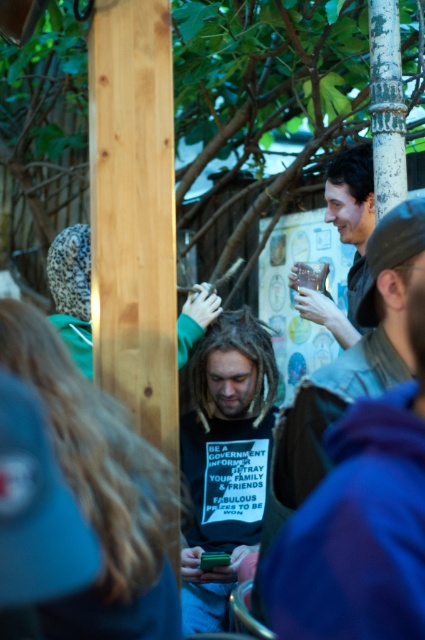
Can you confirm if dark brown leather jacket at center is positioned to the left of smooth brown leather jacket at upper right?

Correct, you'll find dark brown leather jacket at center to the left of smooth brown leather jacket at upper right.

Can you confirm if dark brown leather jacket at center is positioned to the right of smooth brown leather jacket at upper right?

In fact, dark brown leather jacket at center is to the left of smooth brown leather jacket at upper right.

Who is more distant from viewer, (275,528) or (331,305)?

Positioned behind is point (331,305).

I want to click on dark brown leather jacket at center, so click(x=346, y=371).

This screenshot has width=425, height=640. I want to click on black matte t-shirt at center, so click(224, 460).

In the scene shown: Is black matte t-shirt at center in front of dark brown leather jacket at center?

No, black matte t-shirt at center is behind dark brown leather jacket at center.

Find the location of a particular element. black matte t-shirt at center is located at coordinates click(x=224, y=460).

Who is positioned more to the left, dark brown leather jacket at center or white textured pole at upper right?

From the viewer's perspective, dark brown leather jacket at center appears more on the left side.

Which is above, dark brown leather jacket at center or white textured pole at upper right?

white textured pole at upper right is above.

The image size is (425, 640). What do you see at coordinates (346, 371) in the screenshot? I see `dark brown leather jacket at center` at bounding box center [346, 371].

Where is `dark brown leather jacket at center`? dark brown leather jacket at center is located at coordinates (346, 371).